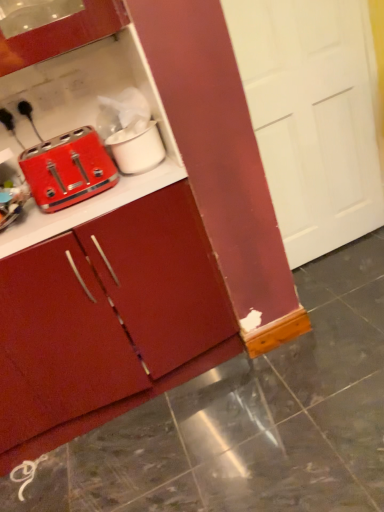
Find the location of a particular element. free location in front of matte red cabinet at center is located at coordinates (157, 466).